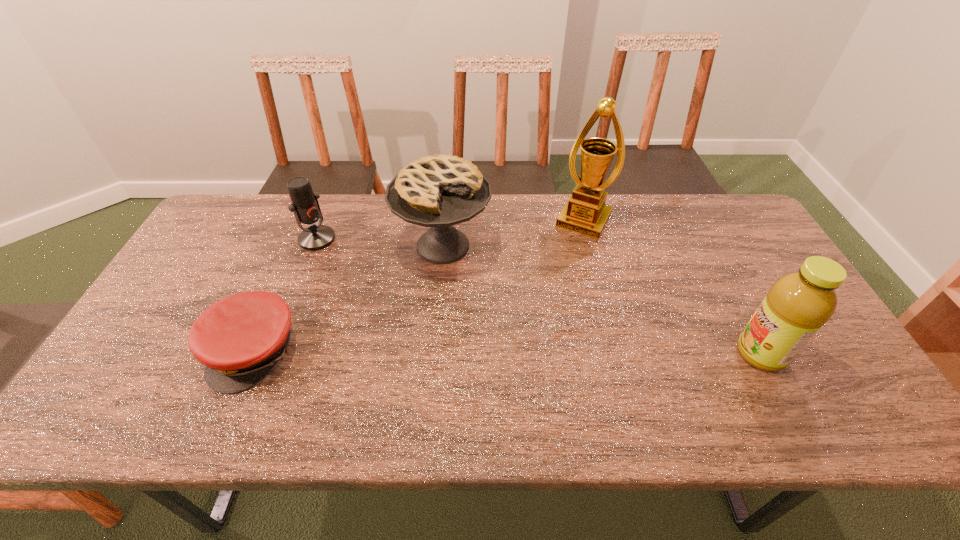
I want to click on the third closest object to the cap, so click(585, 212).

Identify which object is the third closest to the third object from left to right. Please provide its 2D coordinates. Your answer should be formatted as a tuple, i.e. [(x, y)], where the tuple contains the x and y coordinates of a point satisfying the conditions above.

[(239, 339)]

The width and height of the screenshot is (960, 540). In order to click on vacant space that satisfies the following two spatial constraints: 1. on the front of the shortest object with an emblem; 2. on the front label of the fruit juice in this screenshot , I will do pos(253,354).

At what (x,y) coordinates should I click in order to perform the action: click on vacant space that satisfies the following two spatial constraints: 1. on the front side of the fruit juice; 2. on the front label of the award. Please return your answer as a coordinate pair (x, y). Image resolution: width=960 pixels, height=540 pixels. Looking at the image, I should click on (618, 354).

Where is `blank space that satisfies the following two spatial constraints: 1. on the front side of the microphone; 2. on the front label of the rightmost object`? The image size is (960, 540). blank space that satisfies the following two spatial constraints: 1. on the front side of the microphone; 2. on the front label of the rightmost object is located at coordinates (273, 354).

The height and width of the screenshot is (540, 960). I want to click on free space that satisfies the following two spatial constraints: 1. on the front of the fruit juice with an emblem; 2. on the front label of the shortest object, so click(253, 354).

Identify the location of blank area in the image that satisfies the following two spatial constraints: 1. on the front side of the rightmost object; 2. on the front label of the second shortest object. This screenshot has height=540, width=960. (273, 354).